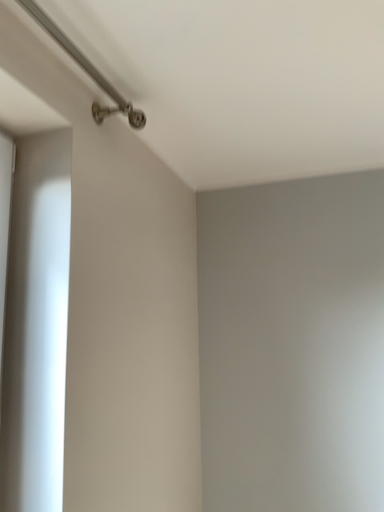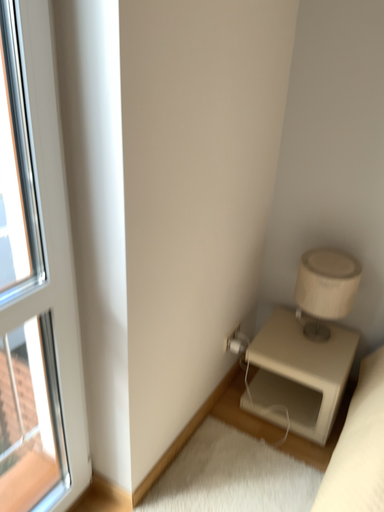
Question: How did the camera likely rotate when shooting the video?

Choices:
 (A) rotated left
 (B) rotated right

Answer: (A)